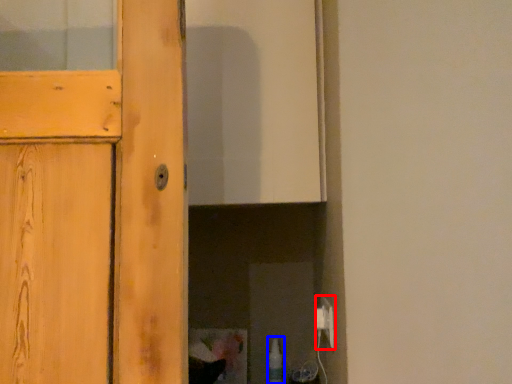
Question: Which point is closer to the camera, electric outlet (highlighted by a red box) or bottle (highlighted by a blue box)?

Choices:
 (A) electric outlet
 (B) bottle

Answer: (A)